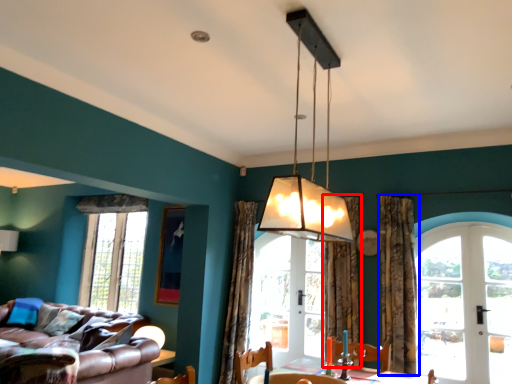
Question: Which object appears farthest to the camera in this image, curtain (highlighted by a red box) or curtain (highlighted by a blue box)?

Choices:
 (A) curtain
 (B) curtain

Answer: (A)